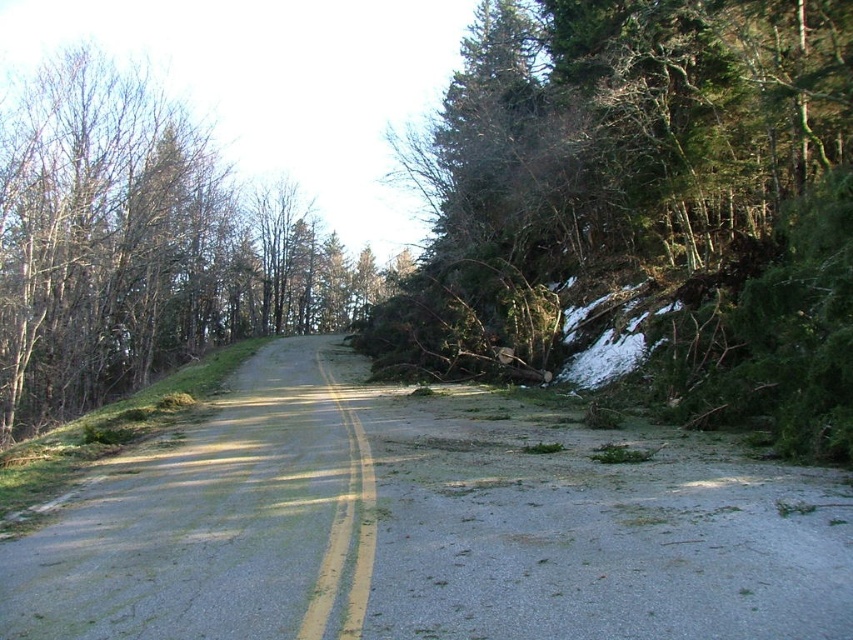
Consider the image. Can you confirm if green leafy tree at left is positioned below smooth asphalt road at center?

Incorrect, green leafy tree at left is not positioned below smooth asphalt road at center.

Can you confirm if green leafy tree at left is smaller than smooth asphalt road at center?

No, green leafy tree at left is not smaller than smooth asphalt road at center.

Where is `green leafy tree at left`? This screenshot has width=853, height=640. green leafy tree at left is located at coordinates (138, 246).

I want to click on green leafy tree at left, so click(138, 246).

Who is positioned more to the left, green textured tree at right or green leafy tree at left?

Positioned to the left is green leafy tree at left.

Which of these two, green textured tree at right or green leafy tree at left, stands taller?

Standing taller between the two is green textured tree at right.

What are the coordinates of `green textured tree at right` in the screenshot? It's located at (643, 205).

Is point (494, 218) positioned in front of point (47, 616)?

No, (494, 218) is further to viewer.

Is green textured tree at right bigger than smooth asphalt road at center?

Indeed, green textured tree at right has a larger size compared to smooth asphalt road at center.

You are a GUI agent. You are given a task and a screenshot of the screen. Output one action in this format:
    pyautogui.click(x=<x>, y=<y>)
    Task: Click on the green textured tree at right
    The height and width of the screenshot is (640, 853).
    Given the screenshot: What is the action you would take?
    pyautogui.click(x=643, y=205)